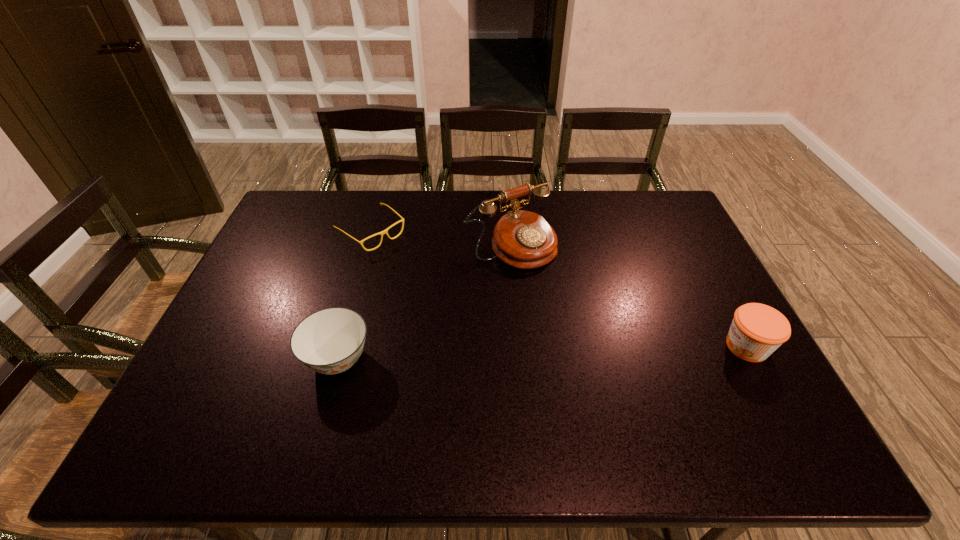
Where is `free space that satisfies the following two spatial constraints: 1. on the back side of the jam; 2. on the front label of the soup bowl`? free space that satisfies the following two spatial constraints: 1. on the back side of the jam; 2. on the front label of the soup bowl is located at coordinates (341, 346).

Find the location of `vacant region that satisfies the following two spatial constraints: 1. on the front side of the jam; 2. on the front label of the shortest object`. vacant region that satisfies the following two spatial constraints: 1. on the front side of the jam; 2. on the front label of the shortest object is located at coordinates (339, 346).